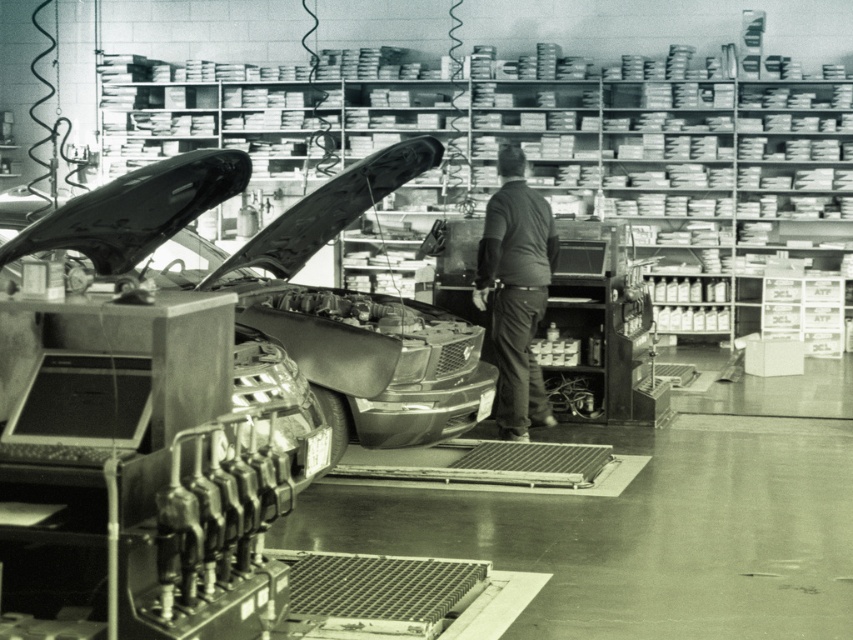
Does shiny chrome car at center have a greater width compared to dark gray shirt at center?

Correct, the width of shiny chrome car at center exceeds that of dark gray shirt at center.

Where is `shiny chrome car at center`? This screenshot has width=853, height=640. shiny chrome car at center is located at coordinates (360, 321).